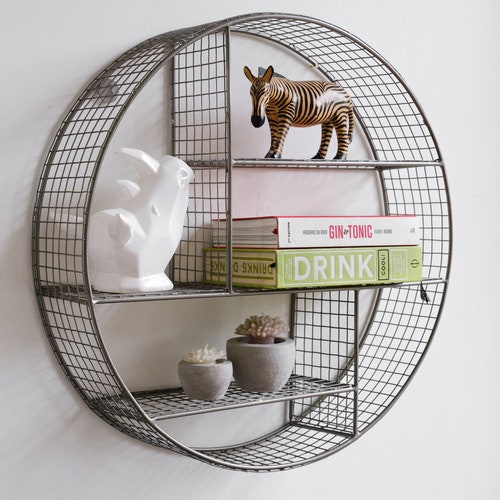
Identify the location of weird white penguine like statue. This screenshot has width=500, height=500. (154, 242).